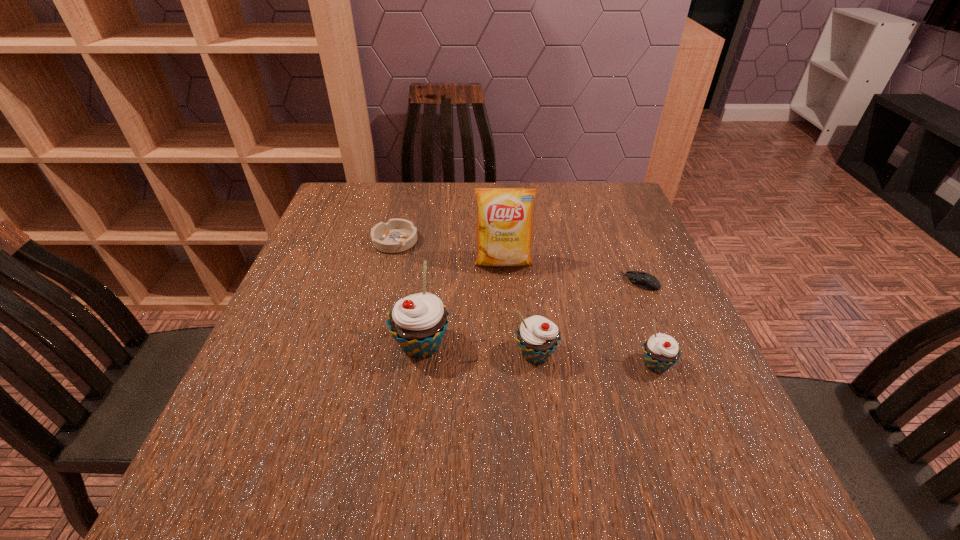
Find the location of a particular element. This screenshot has height=540, width=960. free space located on the left of the third shortest object is located at coordinates (478, 364).

The width and height of the screenshot is (960, 540). In order to click on vacant space positioned 0.130m on the back of the shortest object in this screenshot , I will do `click(623, 241)`.

What are the coordinates of `free spot located 0.100m on the right of the ashtray` in the screenshot? It's located at (456, 241).

The height and width of the screenshot is (540, 960). I want to click on vacant space situated 0.350m on the front-facing side of the crisp (potato chip), so click(x=512, y=399).

You are a GUI agent. You are given a task and a screenshot of the screen. Output one action in this format:
    pyautogui.click(x=<x>, y=<y>)
    Task: Click on the cupcake positioned at the right edge
    The width and height of the screenshot is (960, 540).
    Given the screenshot: What is the action you would take?
    pyautogui.click(x=661, y=351)

Image resolution: width=960 pixels, height=540 pixels. I want to click on computer mouse that is at the right edge, so click(x=646, y=281).

Identify the location of vacant space at the far edge. (452, 184).

Where is `free space at the near edge`? Image resolution: width=960 pixels, height=540 pixels. free space at the near edge is located at coordinates [392, 401].

This screenshot has width=960, height=540. I want to click on vacant space at the left edge, so (296, 355).

Where is `vacant space at the right edge of the desktop`? vacant space at the right edge of the desktop is located at coordinates (660, 265).